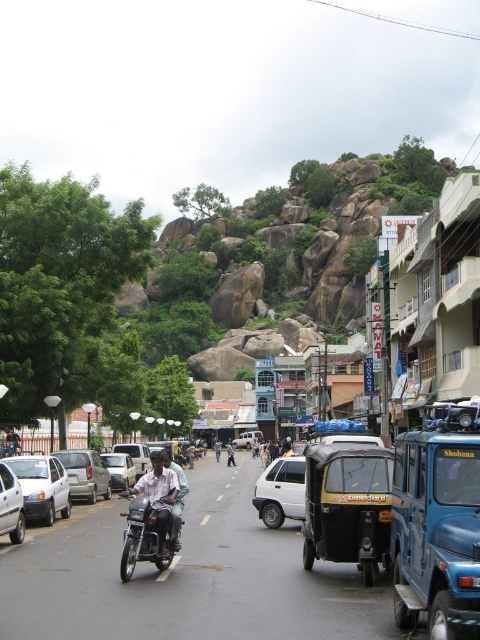
You are a delivery person needing to park your van between the white matte car at left and the silver metallic car at center. Your van is 25 feet long. Can you fit your van in the space between them?

The distance between the white matte car at left and the silver metallic car at center is 73.13 feet. Since your van is only 25 feet long, there is more than enough space to park it between them.

You are a delivery person needing to park your vehicle in this area. You have a white matte car at lower left and a silver metallic car at left. Which one takes up less space in the parking spot?

The white matte car at lower left takes up less space in the parking spot because it is smaller than the silver metallic car at left.